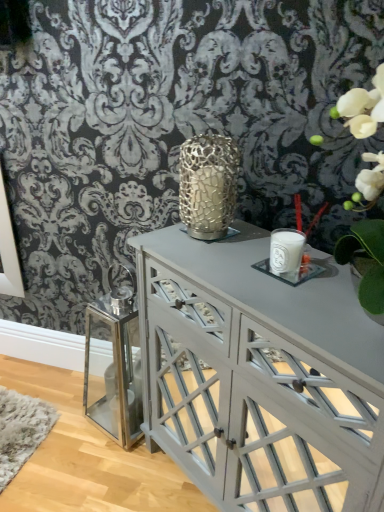
Question: Looking at their shapes, would you say gold textured candle holder at center, which is counted as the second candle holder, starting from the right, is wider or thinner than white glass candle at center, marked as the 1th candle holder in a right-to-left arrangement?

Choices:
 (A) wide
 (B) thin

Answer: (A)

Question: Considering their positions, is gold textured candle holder at center, acting as the first candle holder starting from the left, located in front of or behind white glass candle at center, the second candle holder positioned from the left?

Choices:
 (A) front
 (B) behind

Answer: (B)

Question: Which object is positioned closest to the matte gray cabinet at center?

Choices:
 (A) gold textured candle holder at center, acting as the first candle holder starting from the left
 (B) white glass candle at center, the second candle holder positioned from the left

Answer: (B)

Question: Considering the real-world distances, which object is closest to the gold textured candle holder at center, marked as the 1th candle holder in a top-to-bottom arrangement?

Choices:
 (A) matte gray cabinet at center
 (B) white glass candle at center, the 1th candle holder ordered from the bottom

Answer: (B)